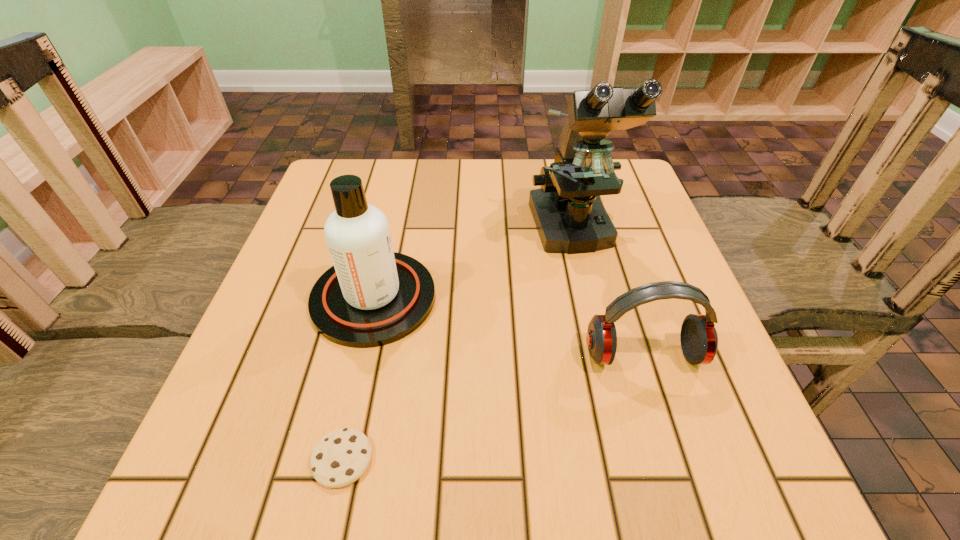
Identify the location of free space between the nearest object and the earphone. (492, 407).

You are a GUI agent. You are given a task and a screenshot of the screen. Output one action in this format:
    pyautogui.click(x=<x>, y=<y>)
    Task: Click on the object that stands as the second closest to the second tallest object
    
    Given the screenshot: What is the action you would take?
    pyautogui.click(x=570, y=218)

Point out which object is positioned as the nearest to the third shortest object. Please provide its 2D coordinates. Your answer should be formatted as a tuple, i.e. [(x, y)], where the tuple contains the x and y coordinates of a point satisfying the conditions above.

[(341, 457)]

This screenshot has width=960, height=540. I want to click on vacant region that satisfies the following two spatial constraints: 1. on the back side of the tallest object; 2. on the right side of the nearest object, so click(393, 231).